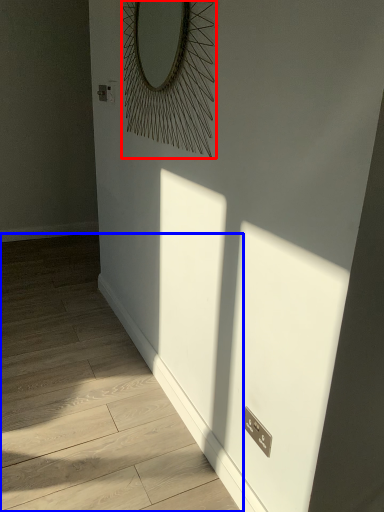
Question: Among these objects, which one is nearest to the camera, mirror (highlighted by a red box) or corridor (highlighted by a blue box)?

Choices:
 (A) mirror
 (B) corridor

Answer: (B)